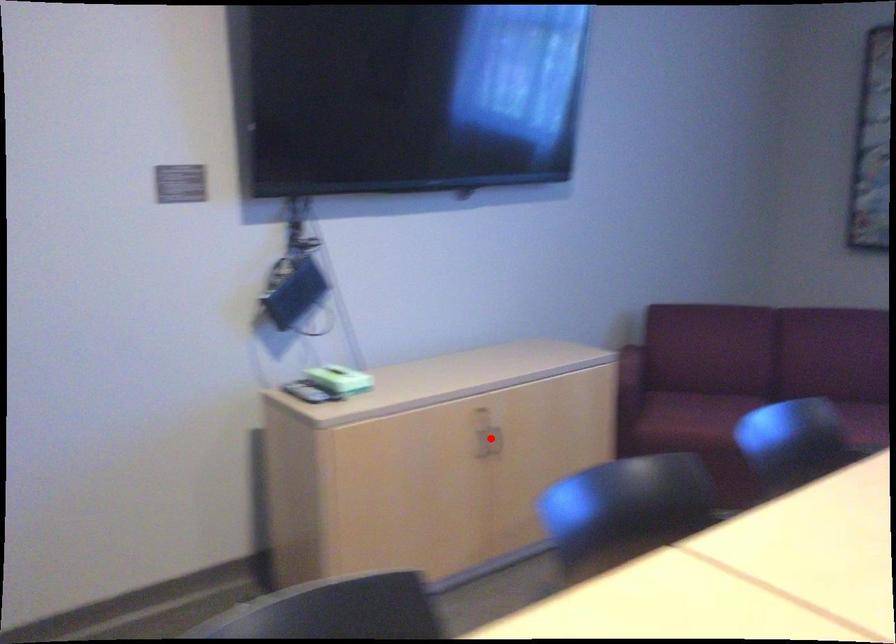
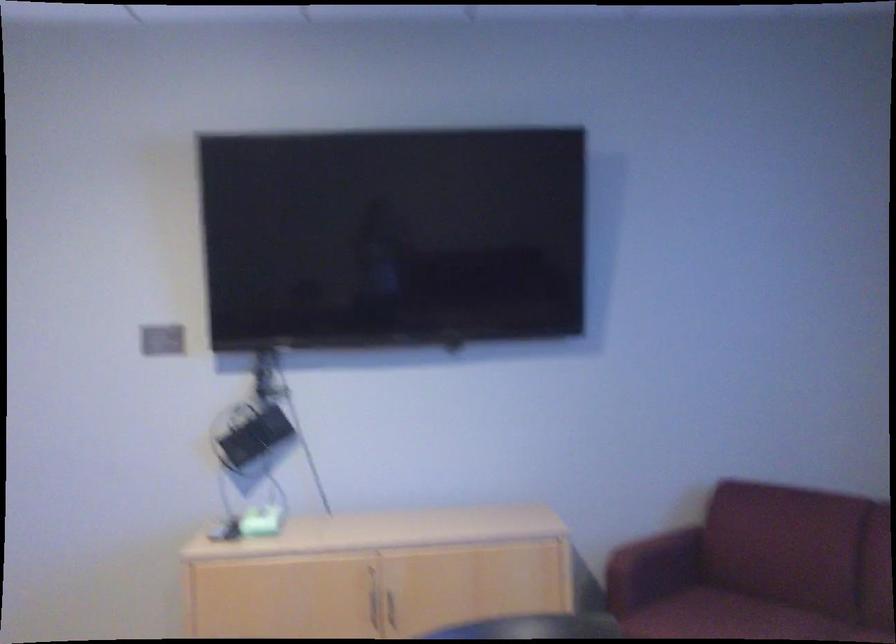
Locate, in the second image, the point that corresponds to the highlighted location in the first image.

(392, 607)